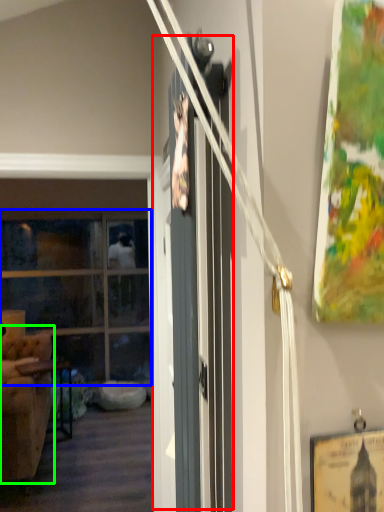
Question: Which object is the farthest from barn door (highlighted by a red box)? Choose among these: window (highlighted by a blue box) or armchair (highlighted by a green box).

Choices:
 (A) window
 (B) armchair

Answer: (A)